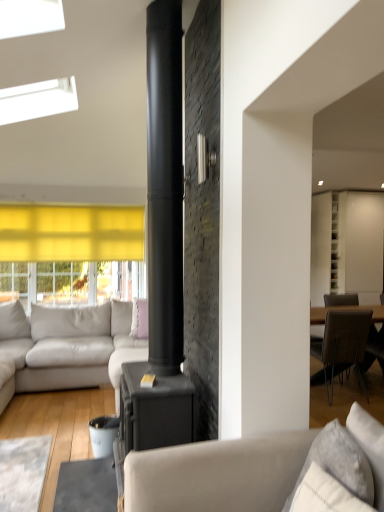
Question: From their relative heights in the image, would you say light gray leather couch at left, marked as the 1th studio couch in a back-to-front arrangement, is taller or shorter than brown textured chair at right?

Choices:
 (A) short
 (B) tall

Answer: (B)

Question: In terms of width, does light gray leather couch at left, which ranks as the 1th studio couch in left-to-right order, look wider or thinner when compared to brown textured chair at right?

Choices:
 (A) thin
 (B) wide

Answer: (B)

Question: Estimate the real-world distances between objects in this image. Which object is farther from the brown textured chair at right?

Choices:
 (A) light gray leather couch at left, which is the 2th studio couch in front-to-back order
 (B) pink fabric pillow at center, which is the second pillow in right-to-left order
 (C) white textured pillow at lower right, arranged as the 1th pillow when viewed from the right
 (D) matte gray couch at center, arranged as the second studio couch when viewed from the back
 (E) white glossy cabinet at upper right

Answer: (C)

Question: Which of these objects is positioned farthest from the white glossy cabinet at upper right?

Choices:
 (A) matte gray couch at center, the 2th studio couch viewed from the left
 (B) light gray leather couch at left, the second studio couch viewed from the right
 (C) white textured pillow at lower right, arranged as the 1th pillow when viewed from the right
 (D) brown textured chair at right
 (E) pink fabric pillow at center, which is the 1th pillow from left to right

Answer: (C)